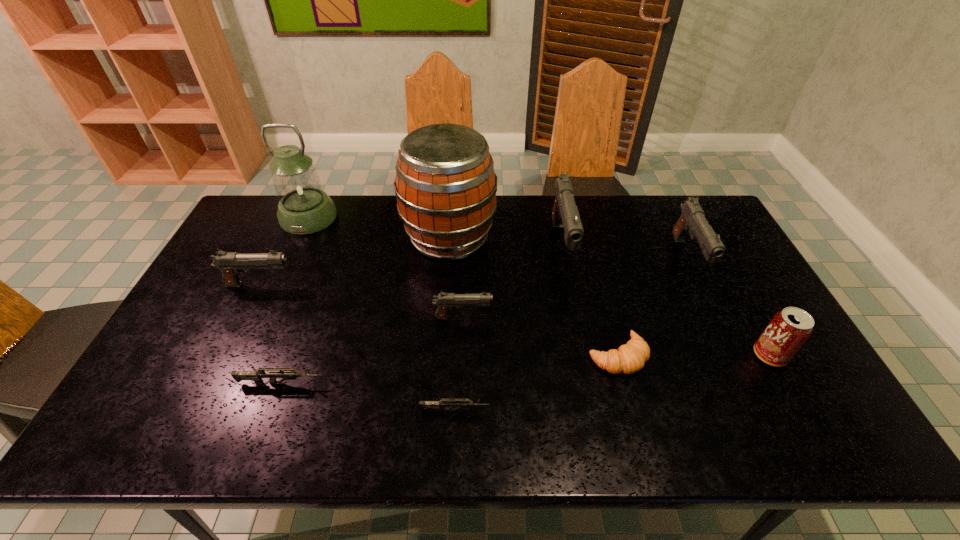
Find the location of `cider`. cider is located at coordinates (445, 185).

You are a GUI agent. You are given a task and a screenshot of the screen. Output one action in this format:
    pyautogui.click(x=<x>, y=<y>)
    Task: Click on the greenish lantern
    
    Given the screenshot: What is the action you would take?
    pyautogui.click(x=304, y=208)

The height and width of the screenshot is (540, 960). Identify the location of the tallest gun. (565, 214).

Where is `the second gray gun from right to left`? the second gray gun from right to left is located at coordinates (565, 214).

The height and width of the screenshot is (540, 960). Identify the location of the rightmost gray gun. (692, 220).

This screenshot has height=540, width=960. Identify the location of the second object from right to left. (692, 220).

Where is `the rightmost object`? the rightmost object is located at coordinates (789, 329).

Where is `soda can`? The height and width of the screenshot is (540, 960). soda can is located at coordinates (789, 329).

This screenshot has height=540, width=960. I want to click on the second smallest gray gun, so click(231, 264).

Locate an element on the screen. The width and height of the screenshot is (960, 540). the leftmost gray gun is located at coordinates (231, 264).